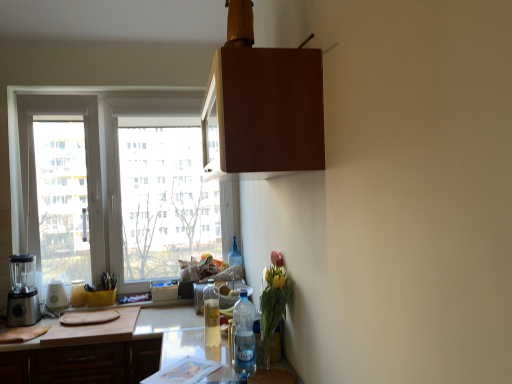
Question: Would you say satin silver blender at left, positioned as the 1th appliance in left-to-right order, is to the left or to the right of translucent glass bottle at lower left, acting as the 4th bottle starting from the right, in the picture?

Choices:
 (A) left
 (B) right

Answer: (A)

Question: From a real-world perspective, is satin silver blender at left, positioned as the 1th appliance in left-to-right order, above or below translucent glass bottle at lower left, acting as the 4th bottle starting from the right?

Choices:
 (A) below
 (B) above

Answer: (B)

Question: Which is farther from the wooden cutting board at lower left, marked as the 2th cabinetry in a top-to-bottom arrangement?

Choices:
 (A) translucent glass bottle at lower left, positioned as the second bottle in back-to-front order
 (B) translucent plastic bottle at center, which is counted as the fourth bottle, starting from the front
 (C) satin silver blender at left, the third appliance viewed from the right
 (D) clear plastic bottle at lower center, the 4th bottle in the back-to-front sequence
 (E) clear plastic bottle at center, which ranks as the third appliance in left-to-right order

Answer: (B)

Question: Which is nearer to the clear plastic bottle at lower center, which is the 4th bottle in left-to-right order?

Choices:
 (A) satin silver blender at left, the third appliance viewed from the right
 (B) wooden cutting board at lower left, marked as the second cabinetry in a front-to-back arrangement
 (C) translucent plastic bottle at center, placed as the second bottle when sorted from right to left
 (D) clear plastic bottle at center, which appears as the 1th appliance when viewed from the right
 (E) translucent glass bottle at lower left, positioned as the second bottle in back-to-front order

Answer: (D)